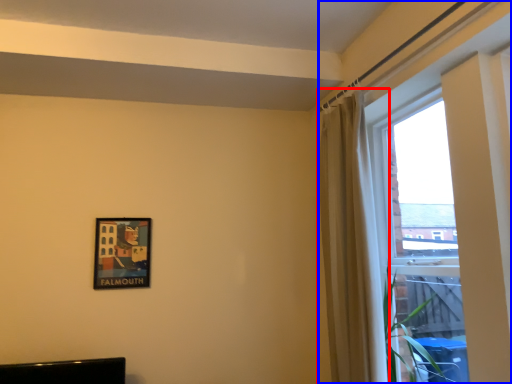
Question: Among these objects, which one is farthest to the camera, curtain (highlighted by a red box) or window (highlighted by a blue box)?

Choices:
 (A) curtain
 (B) window

Answer: (A)